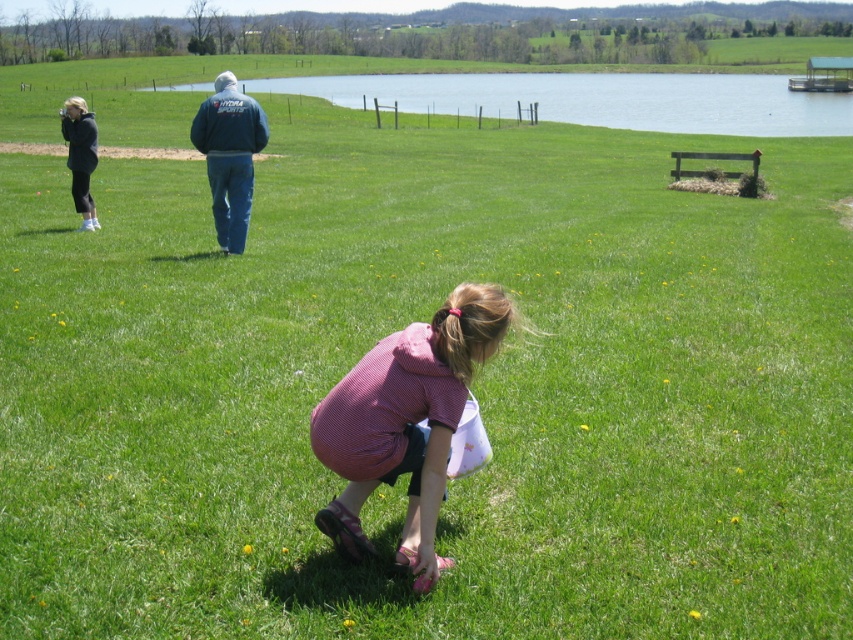
You are standing in the scene and want to walk from the matte black jacket at left to the blue water at upper center. Which direction should you head?

To reach the blue water at upper center from the matte black jacket at left, you should head to the right since the blue water at upper center is located to the right of the matte black jacket at left.